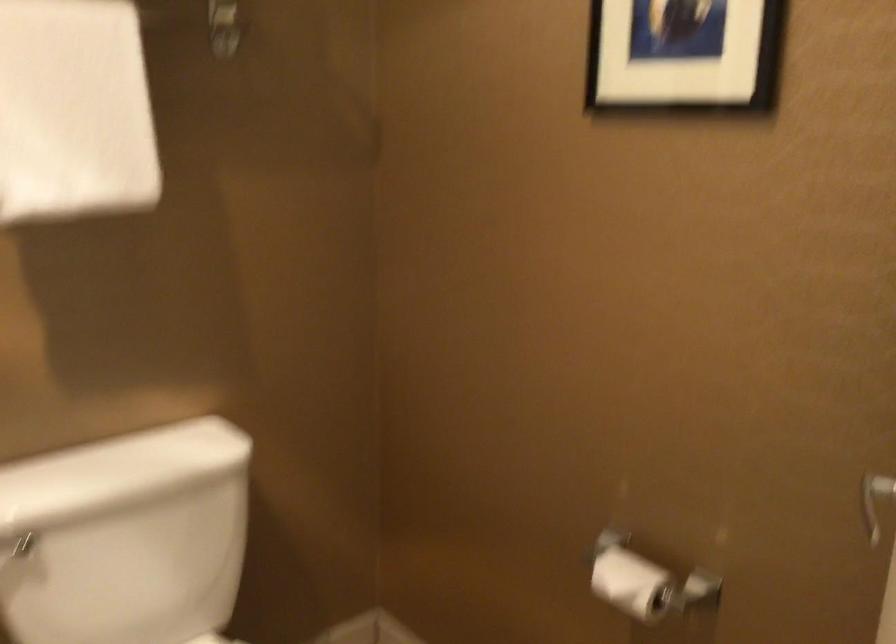
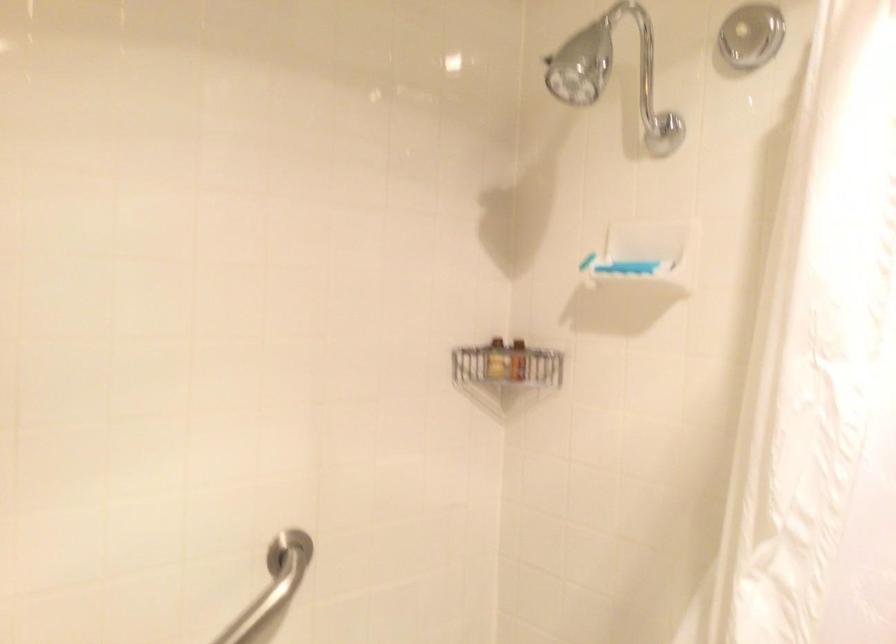
Question: The first image is from the beginning of the video and the second image is from the end. How did the camera likely rotate when shooting the video?

Choices:
 (A) Left
 (B) Right
 (C) Up
 (D) Down

Answer: (A)